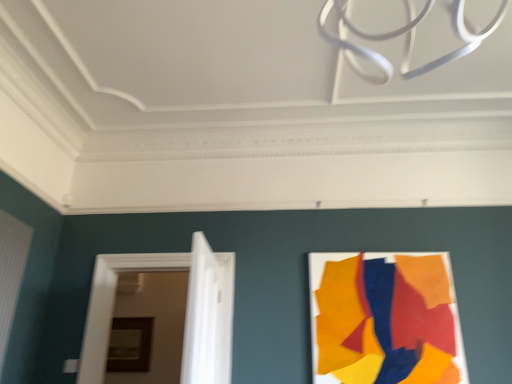
Find the location of `white painted wood door at left, which ranks as the second door in front-to-back order`. white painted wood door at left, which ranks as the second door in front-to-back order is located at coordinates (186, 311).

This screenshot has width=512, height=384. Identify the location of white glossy door at center, marked as the second door in a back-to-front arrangement. (208, 315).

Image resolution: width=512 pixels, height=384 pixels. I want to click on matte acrylic poster at right, so click(x=385, y=319).

I want to click on white painted wood door at left, which ranks as the second door in front-to-back order, so click(186, 311).

Who is smaller, white painted wood door at left, which ranks as the second door in front-to-back order, or white glossy door at center, marked as the first door in a front-to-back arrangement?

white glossy door at center, marked as the first door in a front-to-back arrangement.

Considering the sizes of objects white painted wood door at left, which ranks as the second door in front-to-back order, and white glossy door at center, marked as the second door in a back-to-front arrangement, in the image provided, who is shorter, white painted wood door at left, which ranks as the second door in front-to-back order, or white glossy door at center, marked as the second door in a back-to-front arrangement,?

white glossy door at center, marked as the second door in a back-to-front arrangement.

Where is `door on the right of the white painted wood door at left, acting as the first door starting from the back`? Image resolution: width=512 pixels, height=384 pixels. door on the right of the white painted wood door at left, acting as the first door starting from the back is located at coordinates (208, 315).

Are white painted wood door at left, acting as the first door starting from the back, and white glossy door at center, marked as the second door in a back-to-front arrangement, making contact?

white painted wood door at left, acting as the first door starting from the back, and white glossy door at center, marked as the second door in a back-to-front arrangement, are clearly separated.

From the picture: Could you tell me if matte acrylic poster at right is facing wooden picture frame at center?

No, matte acrylic poster at right is not oriented towards wooden picture frame at center.

Is matte acrylic poster at right positioned beyond the bounds of wooden picture frame at center?

Yes, matte acrylic poster at right is located beyond the bounds of wooden picture frame at center.

Is matte acrylic poster at right to the left or to the right of wooden picture frame at center in the image?

matte acrylic poster at right is positioned on wooden picture frame at center's right side.

Is wooden picture frame at center far from white glossy door at center, marked as the first door in a front-to-back arrangement?

Yes, wooden picture frame at center and white glossy door at center, marked as the first door in a front-to-back arrangement, are located far from each other.

Consider the image. Is wooden picture frame at center aimed at white glossy door at center, marked as the first door in a front-to-back arrangement?

Yes, wooden picture frame at center is aimed at white glossy door at center, marked as the first door in a front-to-back arrangement.

From the picture: Is the position of wooden picture frame at center more distant than that of white glossy door at center, marked as the second door in a back-to-front arrangement?

That is True.

How far apart are wooden picture frame at center and white painted wood door at left, which ranks as the second door in front-to-back order?

A distance of 6.01 feet exists between wooden picture frame at center and white painted wood door at left, which ranks as the second door in front-to-back order.

Looking at their sizes, would you say wooden picture frame at center is wider or thinner than white painted wood door at left, acting as the first door starting from the back?

Considering their sizes, wooden picture frame at center looks slimmer than white painted wood door at left, acting as the first door starting from the back.

You are a GUI agent. You are given a task and a screenshot of the screen. Output one action in this format:
    pyautogui.click(x=<x>, y=<y>)
    Task: Click on the picture frame that appears below the white painted wood door at left, acting as the first door starting from the back (from the image's perspective)
    
    Given the screenshot: What is the action you would take?
    pyautogui.click(x=130, y=344)

From the image's perspective, is wooden picture frame at center located above or below white painted wood door at left, which ranks as the second door in front-to-back order?

Based on their image positions, wooden picture frame at center is located beneath white painted wood door at left, which ranks as the second door in front-to-back order.

Considering the sizes of objects wooden picture frame at center and matte acrylic poster at right in the image provided, who is wider, wooden picture frame at center or matte acrylic poster at right?

Wider between the two is wooden picture frame at center.

Is wooden picture frame at center beside matte acrylic poster at right?

They are not placed beside each other.

Locate an element on the screen. Image resolution: width=512 pixels, height=384 pixels. picture frame behind the matte acrylic poster at right is located at coordinates (130, 344).

Could you tell me if white glossy door at center, marked as the second door in a back-to-front arrangement, is turned towards wooden picture frame at center?

No.

Which object is thinner, white glossy door at center, marked as the first door in a front-to-back arrangement, or wooden picture frame at center?

With smaller width is wooden picture frame at center.

What's the angular difference between white glossy door at center, marked as the second door in a back-to-front arrangement, and wooden picture frame at center's facing directions?

98.8 degrees.

Considering the positions of objects white glossy door at center, marked as the second door in a back-to-front arrangement, and wooden picture frame at center in the image provided, who is behind, white glossy door at center, marked as the second door in a back-to-front arrangement, or wooden picture frame at center?

wooden picture frame at center.

Is white glossy door at center, marked as the second door in a back-to-front arrangement, shorter than matte acrylic poster at right?

Yes, white glossy door at center, marked as the second door in a back-to-front arrangement, is shorter than matte acrylic poster at right.

Consider the image. Do you think white glossy door at center, marked as the first door in a front-to-back arrangement, is within matte acrylic poster at right, or outside of it?

white glossy door at center, marked as the first door in a front-to-back arrangement, exists outside the volume of matte acrylic poster at right.

How different are the orientations of white glossy door at center, marked as the first door in a front-to-back arrangement, and matte acrylic poster at right in degrees?

98.2 degrees separate the facing orientations of white glossy door at center, marked as the first door in a front-to-back arrangement, and matte acrylic poster at right.

Does point (193, 260) lie behind point (460, 356)?

No, it is not.

In the image, there is a white glossy door at center, marked as the first door in a front-to-back arrangement. Identify the location of door below it (from the image's perspective). Image resolution: width=512 pixels, height=384 pixels. (186, 311).

Image resolution: width=512 pixels, height=384 pixels. In order to click on poster in front of the wooden picture frame at center in this screenshot , I will do `click(385, 319)`.

Looking at the image, which one is located closer to matte acrylic poster at right, wooden picture frame at center or white painted wood door at left, which ranks as the second door in front-to-back order?

Based on the image, white painted wood door at left, which ranks as the second door in front-to-back order, appears to be nearer to matte acrylic poster at right.

From the picture: Considering their positions, is matte acrylic poster at right positioned further to white glossy door at center, marked as the first door in a front-to-back arrangement, than wooden picture frame at center?

wooden picture frame at center lies further to white glossy door at center, marked as the first door in a front-to-back arrangement, than the other object.

When comparing their distances from wooden picture frame at center, does white painted wood door at left, which ranks as the second door in front-to-back order, or white glossy door at center, marked as the first door in a front-to-back arrangement, seem closer?

white painted wood door at left, which ranks as the second door in front-to-back order.

When comparing their distances from white glossy door at center, marked as the second door in a back-to-front arrangement, does matte acrylic poster at right or white painted wood door at left, which ranks as the second door in front-to-back order, seem closer?

white painted wood door at left, which ranks as the second door in front-to-back order, is positioned closer to the anchor white glossy door at center, marked as the second door in a back-to-front arrangement.

Based on their spatial positions, is white glossy door at center, marked as the second door in a back-to-front arrangement, or matte acrylic poster at right closer to wooden picture frame at center?

white glossy door at center, marked as the second door in a back-to-front arrangement, is positioned closer to the anchor wooden picture frame at center.

From the picture: Considering their positions, is white painted wood door at left, acting as the first door starting from the back, positioned further to wooden picture frame at center than matte acrylic poster at right?

matte acrylic poster at right lies further to wooden picture frame at center than the other object.

Considering their positions, is matte acrylic poster at right positioned further to wooden picture frame at center than white glossy door at center, marked as the second door in a back-to-front arrangement?

Among the two, matte acrylic poster at right is located further to wooden picture frame at center.

When comparing their distances from white glossy door at center, marked as the second door in a back-to-front arrangement, does wooden picture frame at center or white painted wood door at left, which ranks as the second door in front-to-back order, seem closer?

Based on the image, white painted wood door at left, which ranks as the second door in front-to-back order, appears to be nearer to white glossy door at center, marked as the second door in a back-to-front arrangement.

Locate an element on the screen. The height and width of the screenshot is (384, 512). door between white painted wood door at left, acting as the first door starting from the back, and matte acrylic poster at right, in the horizontal direction is located at coordinates (208, 315).

Locate an element on the screen. The image size is (512, 384). poster positioned between white glossy door at center, marked as the second door in a back-to-front arrangement, and wooden picture frame at center from near to far is located at coordinates (385, 319).

Where is `door positioned between white glossy door at center, marked as the second door in a back-to-front arrangement, and wooden picture frame at center from near to far`? door positioned between white glossy door at center, marked as the second door in a back-to-front arrangement, and wooden picture frame at center from near to far is located at coordinates (186, 311).